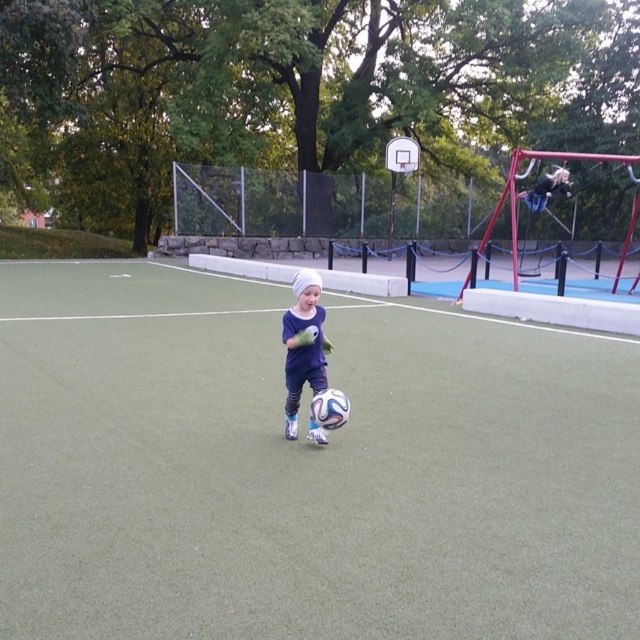
Does matte blue soccer ball at center appear on the left side of metallic silver basketball hoop at upper center?

Yes, matte blue soccer ball at center is to the left of metallic silver basketball hoop at upper center.

Is point (314, 285) in front of point (401, 168)?

Yes, it is.

At what (x,y) coordinates should I click in order to perform the action: click on matte blue soccer ball at center. Please return your answer as a coordinate pair (x, y). Image resolution: width=640 pixels, height=640 pixels. Looking at the image, I should click on pyautogui.click(x=304, y=346).

Is green artificial turf at center closer to camera compared to metallic silver basketball hoop at upper center?

That is True.

Where is `green artificial turf at center`? green artificial turf at center is located at coordinates (305, 468).

Between point (609, 602) and point (406, 138), which one is positioned in front?

Point (609, 602) is in front.

Where is `green artificial turf at center`? This screenshot has width=640, height=640. green artificial turf at center is located at coordinates (305, 468).

Can you confirm if green artificial turf at center is positioned to the left of matte blue soccer ball at center?

Yes, green artificial turf at center is to the left of matte blue soccer ball at center.

Between green artificial turf at center and matte blue soccer ball at center, which one is positioned lower?

Positioned lower is green artificial turf at center.

Is point (376, 394) positioned in front of point (308, 278)?

No, it is not.

Find the location of `green artificial turf at center`. green artificial turf at center is located at coordinates (305, 468).